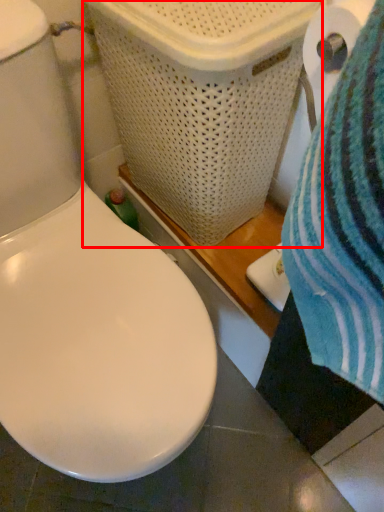
Question: Observing the image, what is the correct spatial positioning of laundry basket (annotated by the red box) in reference to toilet paper?

Choices:
 (A) right
 (B) left

Answer: (B)